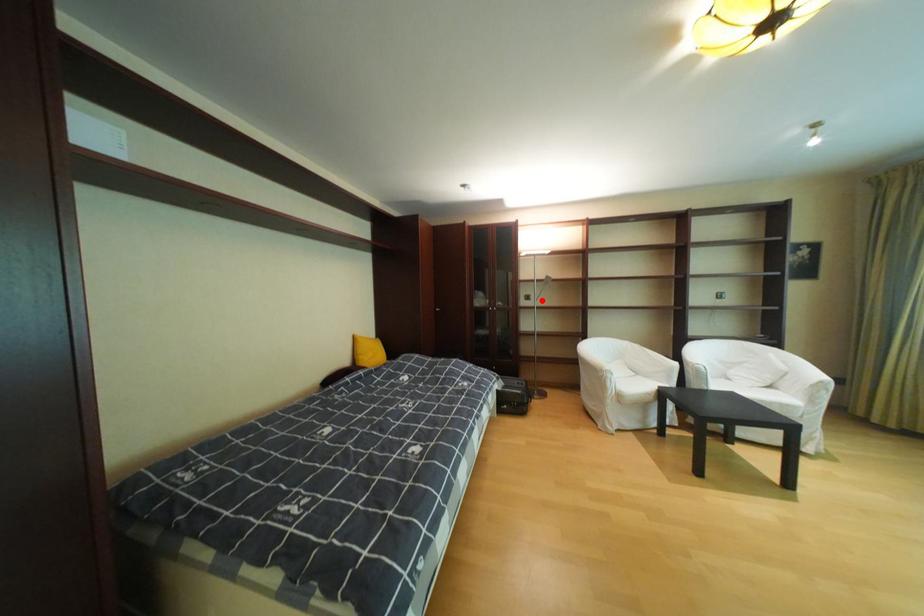
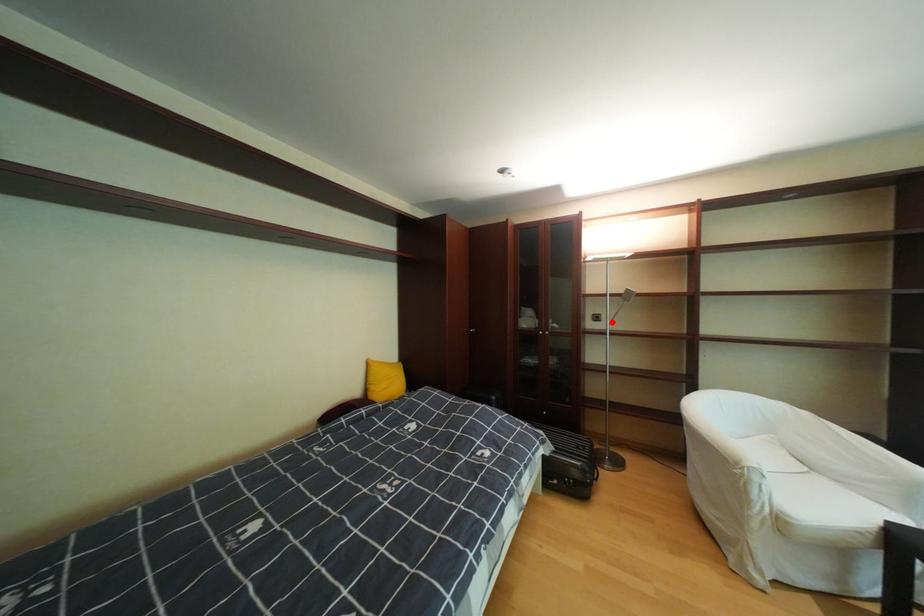
I am providing you with two images of the same scene from different viewpoints. A red point is marked on the first image and another point is marked on the second image. Is the red point in image1 aligned with the point shown in image2?

Yes